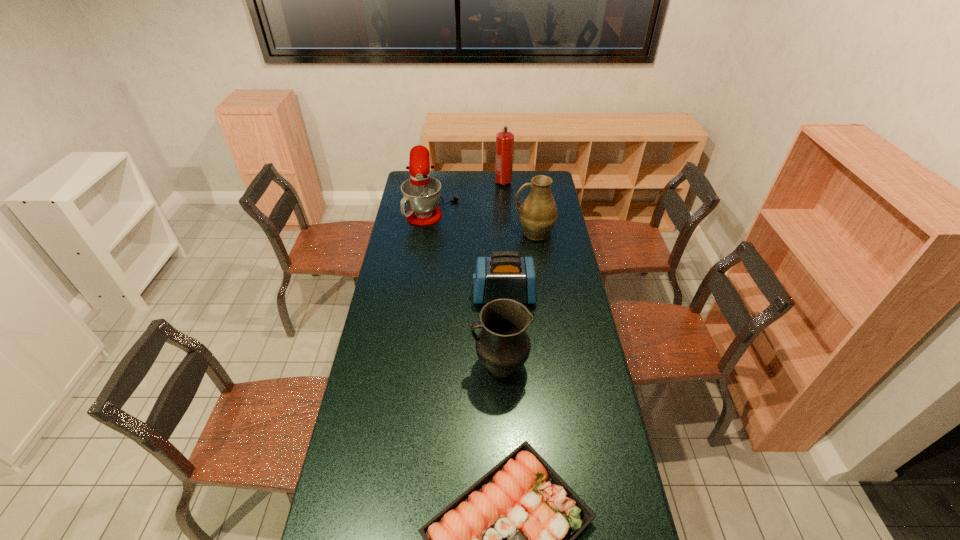
Find the location of a particular element. The width and height of the screenshot is (960, 540). vacant region located on the handle side of the farther pitcher is located at coordinates (454, 232).

Locate an element on the screen. vacant space situated on the handle side of the second nearest object is located at coordinates (375, 366).

The width and height of the screenshot is (960, 540). What are the coordinates of `free location located 0.150m on the handle side of the second nearest object` in the screenshot? It's located at (433, 366).

At what (x,y) coordinates should I click in order to perform the action: click on vacant area situated 0.280m on the handle side of the second nearest object. Please return your answer as a coordinate pair (x, y). Looking at the image, I should click on (398, 366).

Image resolution: width=960 pixels, height=540 pixels. I want to click on free space located on the front-facing side of the third nearest object, so click(431, 295).

This screenshot has width=960, height=540. In order to click on vacant space located on the front-facing side of the third nearest object in this screenshot , I will do 397,295.

The width and height of the screenshot is (960, 540). Identify the location of vacant space situated on the front-facing side of the third nearest object. (422, 295).

What are the coordinates of `fire extinguisher located in the far edge section of the desktop` in the screenshot? It's located at (504, 140).

This screenshot has width=960, height=540. What are the coordinates of `mixer situated at the far edge` in the screenshot? It's located at (421, 193).

At what (x,y) coordinates should I click in order to perform the action: click on object that is at the left edge. Please return your answer as a coordinate pair (x, y). Looking at the image, I should click on point(421,193).